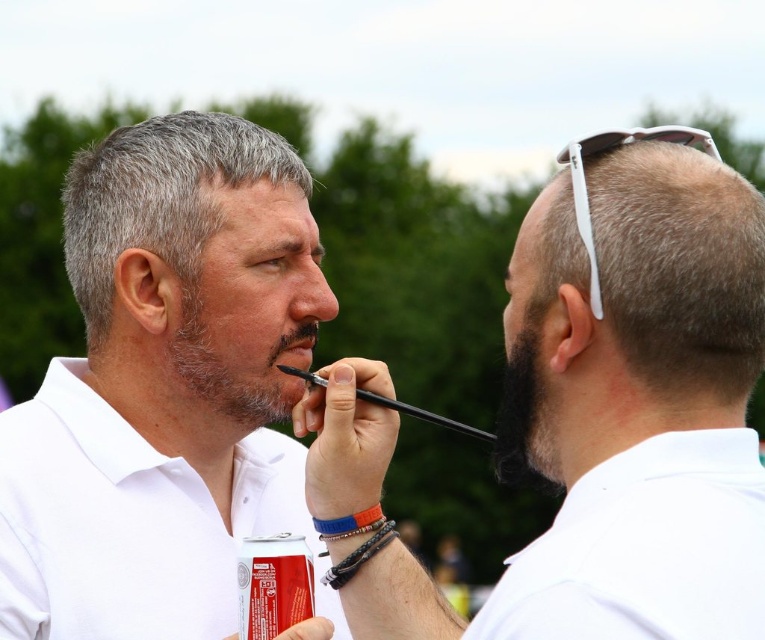
You are a photographer capturing a candid moment between two people. You notice the white cotton polo shirt at right and the smooth skin nose at center. Which object is closer to the camera in this scene?

The white cotton polo shirt at right is in front of the smooth skin nose at center, so it is closer to the camera.

You are a photographer trying to capture a candid shot of the smooth skin nose at center during this interaction. Since the gray hair at upper right is blocking part of the view, can you adjust your position to get a clear shot without moving the subjects?

The gray hair at upper right is closer to the viewer than the smooth skin nose at center, so adjusting your position slightly to the side or angle your camera might allow you to avoid the obstruction caused by the gray hair at upper right and capture the smooth skin nose at center clearly.